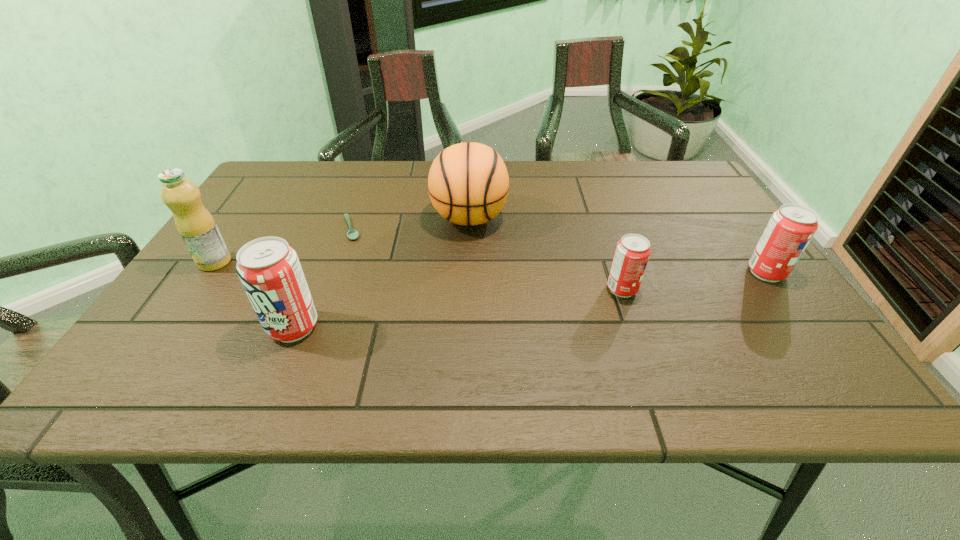
Where is `vacant area between the rightmost object and the second soda can from right to left`? This screenshot has height=540, width=960. vacant area between the rightmost object and the second soda can from right to left is located at coordinates (694, 281).

At what (x,y) coordinates should I click in order to perform the action: click on unoccupied position between the second object from right to left and the rightmost soda can. Please return your answer as a coordinate pair (x, y). The height and width of the screenshot is (540, 960). Looking at the image, I should click on (694, 281).

Identify the location of vacant area between the soupspoon and the rightmost soda can. This screenshot has width=960, height=540. (559, 251).

Choose which object is the fourth nearest neighbor to the leftmost soda can. Please provide its 2D coordinates. Your answer should be formatted as a tuple, i.e. [(x, y)], where the tuple contains the x and y coordinates of a point satisfying the conditions above.

[(632, 253)]

In order to click on object identified as the fifth closest to the second soda can from left to right in this screenshot , I will do `click(195, 224)`.

Locate an element on the screen. Image resolution: width=960 pixels, height=540 pixels. soda can that is the closest to the rightmost soda can is located at coordinates (632, 253).

You are a GUI agent. You are given a task and a screenshot of the screen. Output one action in this format:
    pyautogui.click(x=<x>, y=<y>)
    Task: Click on the soda can that stands as the second closest to the third shortest object
    Image resolution: width=960 pixels, height=540 pixels.
    Given the screenshot: What is the action you would take?
    pyautogui.click(x=269, y=269)

I want to click on blank space that satisfies the following two spatial constraints: 1. on the front label of the second soda can from left to right; 2. on the right side of the fruit juice, so click(x=196, y=289).

Locate an element on the screen. The image size is (960, 540). free spot that satisfies the following two spatial constraints: 1. on the front label of the tallest soda can; 2. on the left side of the fruit juice is located at coordinates (170, 327).

In order to click on free space that satisfies the following two spatial constraints: 1. on the back side of the nearest soda can; 2. on the right side of the rightmost soda can in this screenshot , I will do `click(316, 273)`.